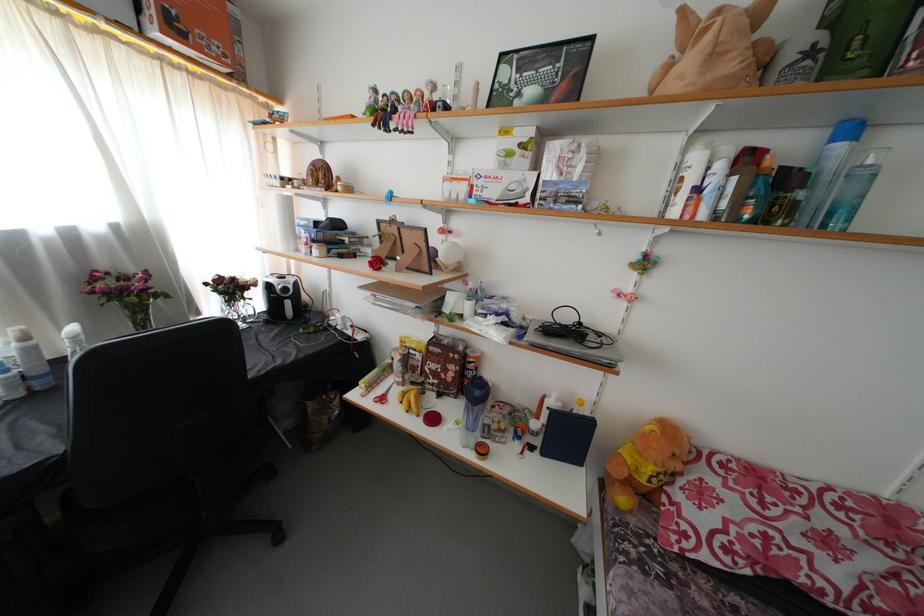
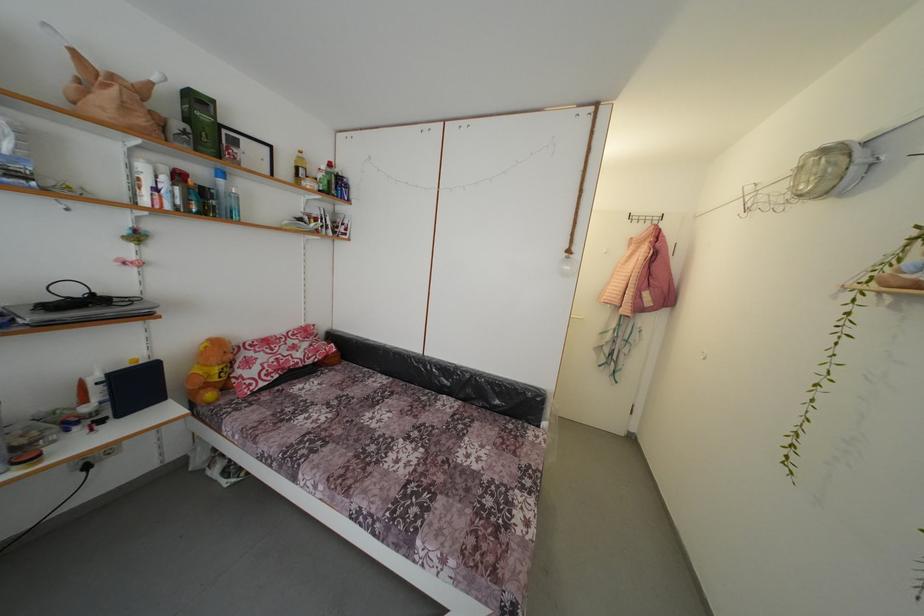
The first image is from the beginning of the video and the second image is from the end. How did the camera likely rotate when shooting the video?

The rotation direction of the camera is right-down.